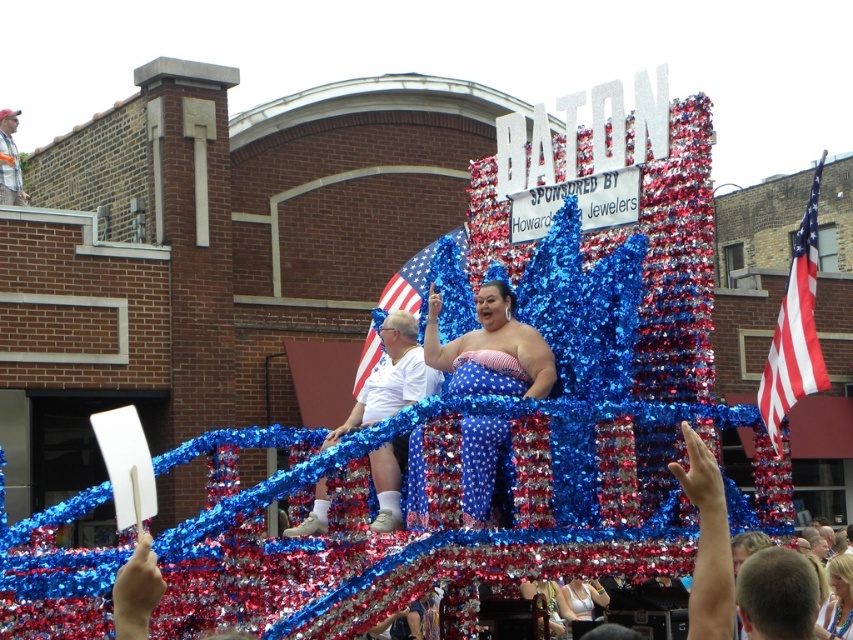
Question: Is shiny metallic dress at center smaller than white matte t-shirt at center?

Choices:
 (A) yes
 (B) no

Answer: (A)

Question: Is red-white-blue fabric flag at right smaller than white plastic cup at upper left?

Choices:
 (A) yes
 (B) no

Answer: (B)

Question: Does shiny metallic dress at center have a larger size compared to red-white-blue fabric flag at right?

Choices:
 (A) no
 (B) yes

Answer: (A)

Question: Which point is closer to the camera taking this photo?

Choices:
 (A) (398, 298)
 (B) (830, 566)
 (C) (810, 211)

Answer: (C)

Question: Which point is closer to the camera?

Choices:
 (A) red-white-blue fabric flag at right
 (B) american flag at center
 (C) blonde hair at upper center

Answer: (A)

Question: Based on their relative distances, which object is farther from the red-white-blue fabric flag at right?

Choices:
 (A) american flag at center
 (B) shiny metallic dress at center

Answer: (A)